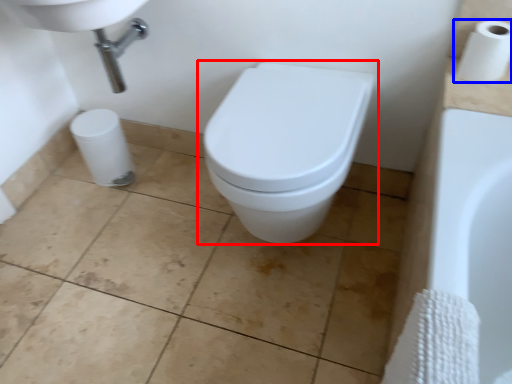
Question: Which of the following is the farthest to the observer, toilet (highlighted by a red box) or toilet paper (highlighted by a blue box)?

Choices:
 (A) toilet
 (B) toilet paper

Answer: (B)